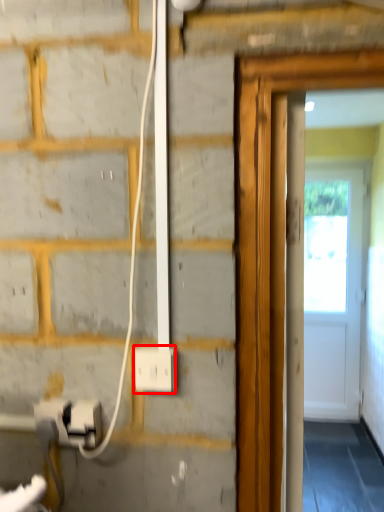
Question: Considering the relative positions of power plugs and sockets (annotated by the red box) and electric outlet in the image provided, where is power plugs and sockets (annotated by the red box) located with respect to the staircase?

Choices:
 (A) right
 (B) left

Answer: (A)